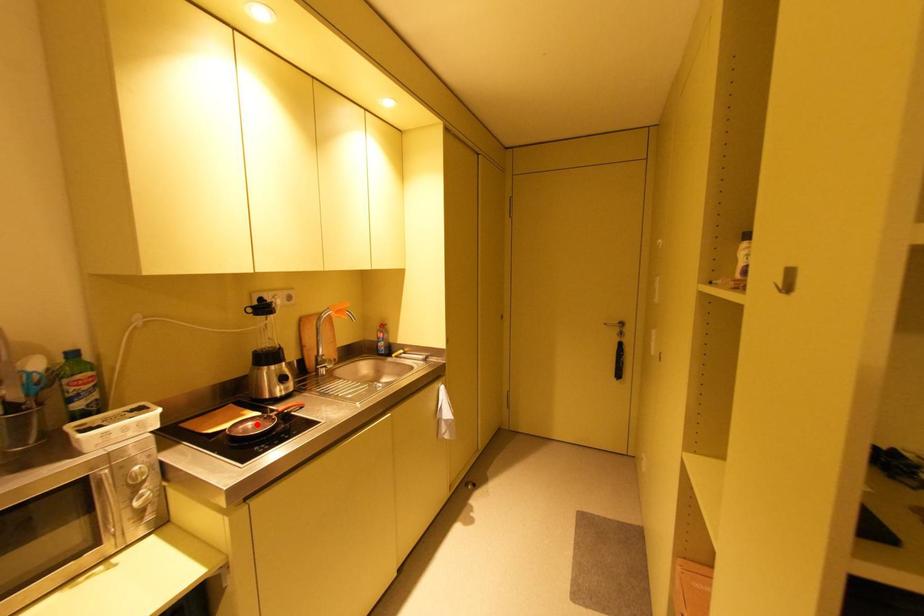
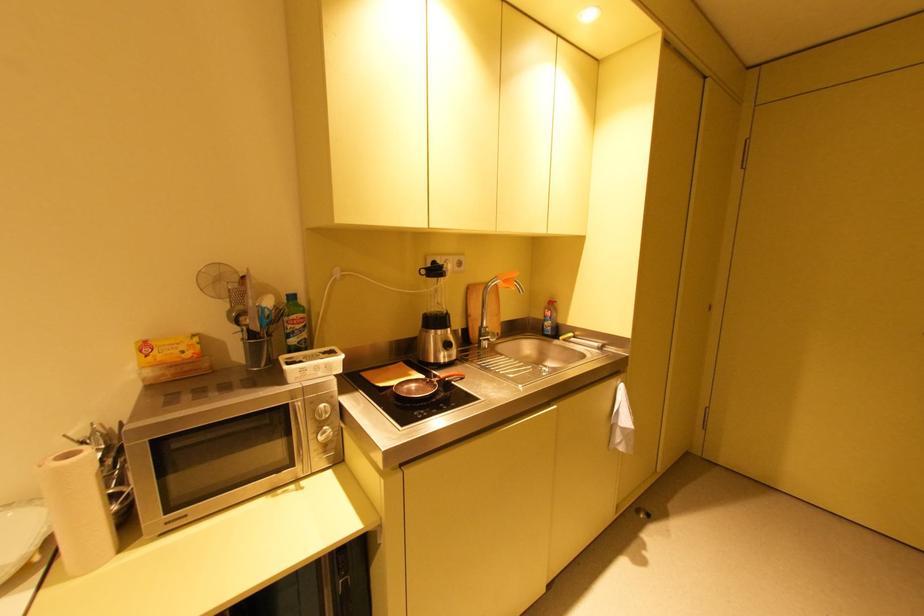
Where in the second image is the point corresponding to the highlighted location from the first image?

(420, 387)